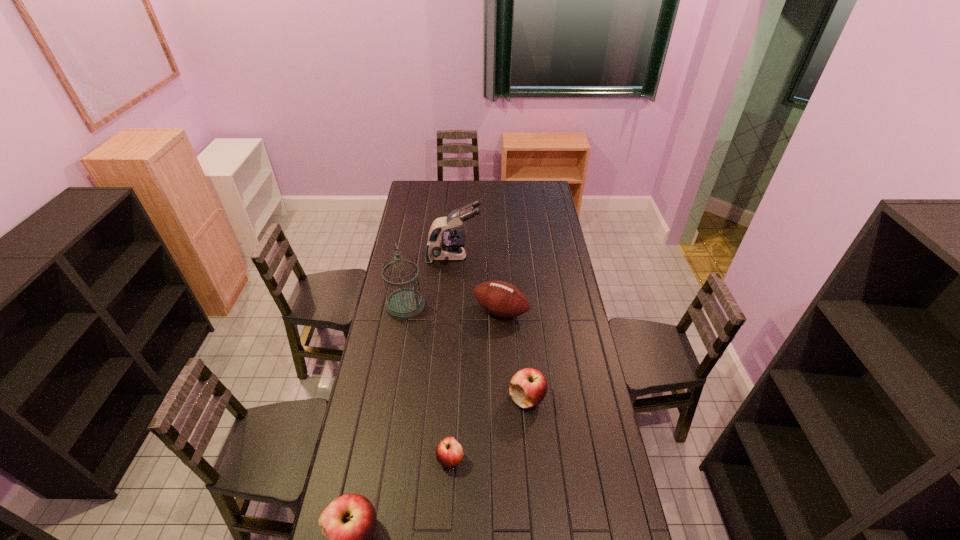
Find the location of `vacant space located through the eyepieces of the microscope`. vacant space located through the eyepieces of the microscope is located at coordinates (542, 256).

The height and width of the screenshot is (540, 960). I want to click on vacant area situated 0.230m on the back of the football (American), so click(498, 267).

The width and height of the screenshot is (960, 540). Identify the location of object that is at the left edge. (405, 303).

Locate an element on the screen. The height and width of the screenshot is (540, 960). free space at the far edge of the desktop is located at coordinates (525, 187).

Find the location of a particular element. The width and height of the screenshot is (960, 540). vacant space at the left edge of the desktop is located at coordinates (408, 240).

Image resolution: width=960 pixels, height=540 pixels. Identify the location of free region at the right edge of the desktop. (582, 420).

You are a GUI agent. You are given a task and a screenshot of the screen. Output one action in this format:
    pyautogui.click(x=<x>, y=<y>)
    Task: Click on the free space at the far right corner of the desktop
    The width and height of the screenshot is (960, 540).
    Given the screenshot: What is the action you would take?
    pyautogui.click(x=532, y=197)

Where is `free spot between the farthest object and the second tallest apple`? This screenshot has width=960, height=540. free spot between the farthest object and the second tallest apple is located at coordinates (491, 327).

Where is `vacant space in between the football (American) and the second nearest object`? The width and height of the screenshot is (960, 540). vacant space in between the football (American) and the second nearest object is located at coordinates (475, 385).

Find the location of a particular element. The image size is (960, 540). free space that is in between the farthest apple and the football (American) is located at coordinates (514, 355).